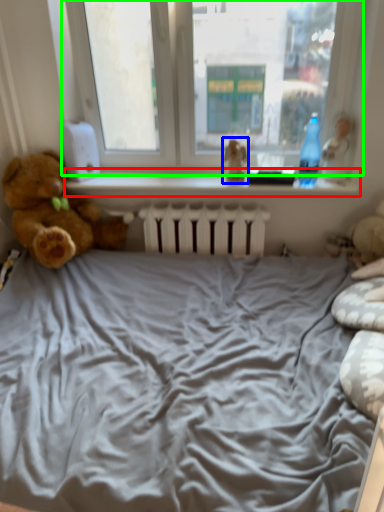
Question: Considering the real-world distances, which object is closest to window sill (highlighted by a red box)? toy (highlighted by a blue box) or window (highlighted by a green box).

Choices:
 (A) toy
 (B) window

Answer: (A)